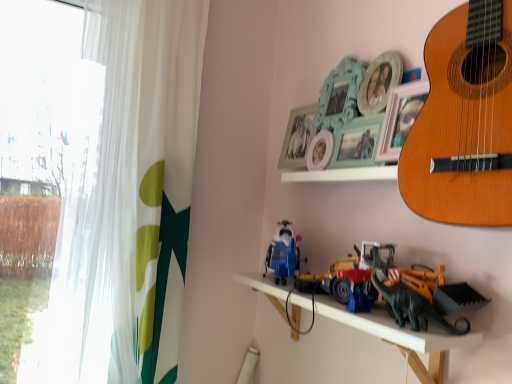
Question: From the image's perspective, relative to yellow plastic construction vehicle at lower right, the third toy viewed from the left, is white sheer curtain at left above or below?

Choices:
 (A) above
 (B) below

Answer: (A)

Question: Considering the positions of white sheer curtain at left and yellow plastic construction vehicle at lower right, the third toy viewed from the left, in the image, is white sheer curtain at left bigger or smaller than yellow plastic construction vehicle at lower right, the third toy viewed from the left,?

Choices:
 (A) small
 (B) big

Answer: (B)

Question: Estimate the real-world distances between objects in this image. Which object is farther from the yellow plastic construction vehicle at lower right, which ranks as the 1th toy in right-to-left order?

Choices:
 (A) transparent fabric at left
 (B) white sheer curtain at left
 (C) green matte dinosaur at lower right, which ranks as the second toy in left-to-right order
 (D) blue plastic toy truck at center, positioned as the 3th toy in right-to-left order
 (E) white wooden shelf at upper center

Answer: (A)

Question: Estimate the real-world distances between objects in this image. Which object is farther from the transparent fabric at left?

Choices:
 (A) yellow plastic construction vehicle at lower right, which ranks as the 1th toy in right-to-left order
 (B) blue plastic toy truck at center, the first toy positioned from the left
 (C) metallic plastic toys at center
 (D) green matte dinosaur at lower right, which ranks as the second toy in left-to-right order
 (E) light brown wooden guitar at upper right

Answer: (D)